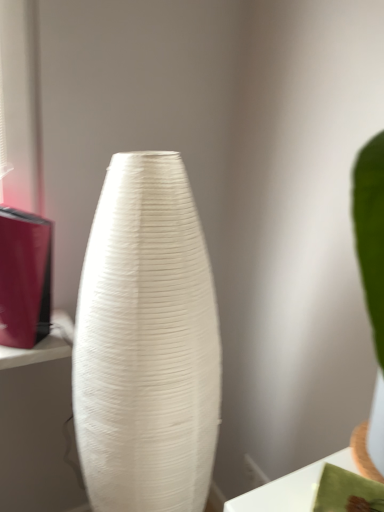
Question: Can you confirm if white glossy table at lower right is taller than white textured vase at center?

Choices:
 (A) no
 (B) yes

Answer: (A)

Question: Is white glossy table at lower right next to white textured vase at center?

Choices:
 (A) no
 (B) yes

Answer: (A)

Question: Is white glossy table at lower right looking in the opposite direction of white textured vase at center?

Choices:
 (A) no
 (B) yes

Answer: (A)

Question: Is white glossy table at lower right far away from white textured vase at center?

Choices:
 (A) yes
 (B) no

Answer: (B)

Question: From the image's perspective, is white glossy table at lower right over white textured vase at center?

Choices:
 (A) yes
 (B) no

Answer: (A)

Question: Is white glossy table at lower right positioned behind white textured vase at center?

Choices:
 (A) yes
 (B) no

Answer: (B)

Question: Is white textured vase at center next to white glossy table at lower right?

Choices:
 (A) no
 (B) yes

Answer: (A)

Question: Is white textured vase at center positioned behind white glossy table at lower right?

Choices:
 (A) yes
 (B) no

Answer: (A)

Question: From a real-world perspective, is white textured vase at center positioned under white glossy table at lower right based on gravity?

Choices:
 (A) yes
 (B) no

Answer: (A)

Question: Does white textured vase at center have a smaller size compared to white glossy table at lower right?

Choices:
 (A) yes
 (B) no

Answer: (B)

Question: Can you confirm if white textured vase at center is bigger than white glossy table at lower right?

Choices:
 (A) no
 (B) yes

Answer: (B)

Question: From a real-world perspective, does white textured vase at center stand above white glossy table at lower right?

Choices:
 (A) no
 (B) yes

Answer: (A)

Question: Considering their positions, is white glossy table at lower right located in front of or behind white textured vase at center?

Choices:
 (A) behind
 (B) front

Answer: (B)